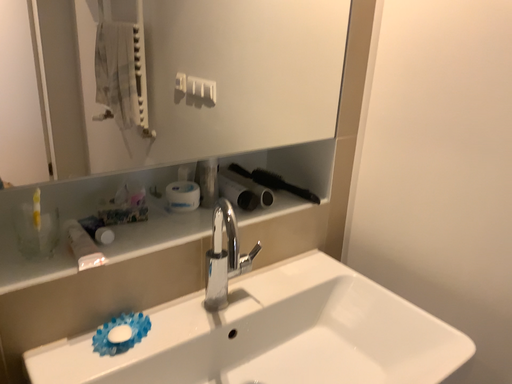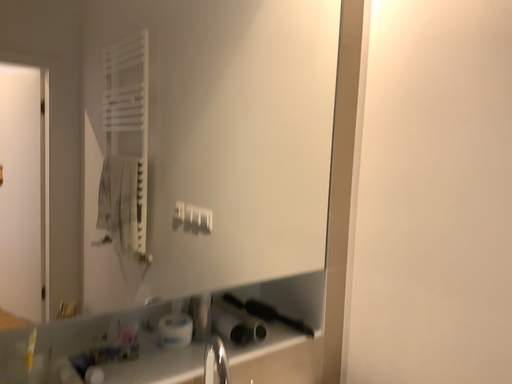
Question: How did the camera likely rotate when shooting the video?

Choices:
 (A) rotated upward
 (B) rotated downward

Answer: (A)